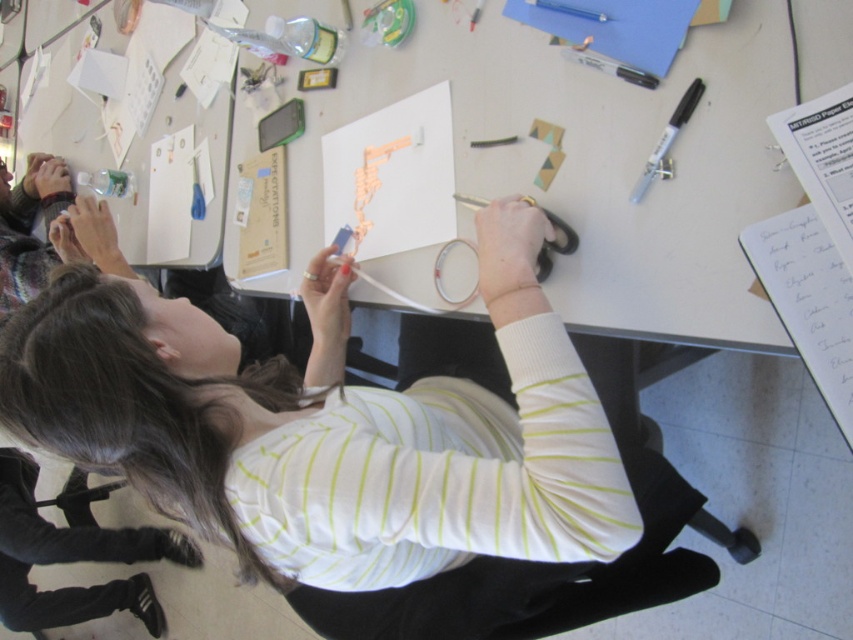
Based on the scene description, what is the 2D coordinate of the white striped shirt at center?

The 2D coordinate of the white striped shirt at center is at point (341, 445).

You are observing a craft activity at the workspace. There is a white striped shirt at center and a white paper at center. From the observer perspective, which object is positioned to the right?

The white paper at center is positioned to the right of the white striped shirt at center.

You are a student trying to organize the items on the table. The white paper at center and the orange foam letters at center are both in the center area. Which item is closer to you?

The white paper at center is closer to you because it is in front of the orange foam letters at center.